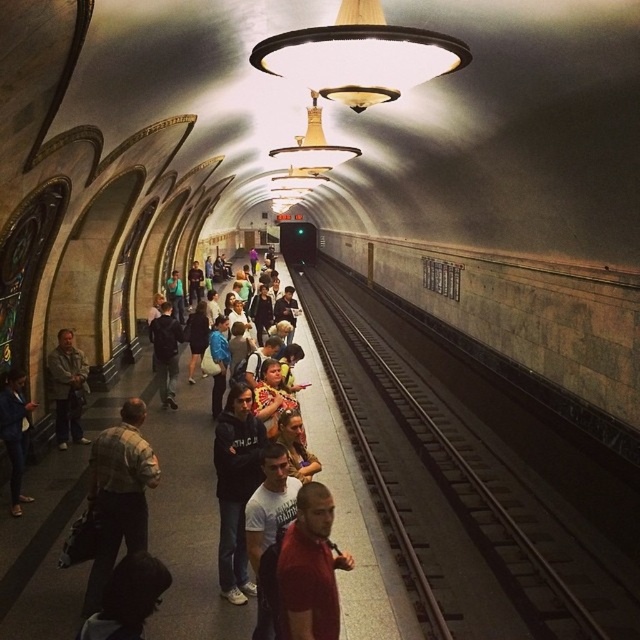
Which of these two, matte red shirt at center or black matte jacket at center, stands taller?

black matte jacket at center

Does matte red shirt at center come in front of black matte jacket at center?

Yes, matte red shirt at center is in front of black matte jacket at center.

Measure the distance between point (284, 556) and camera.

The distance of point (284, 556) from camera is 12.55 feet.

Identify the location of matte red shirt at center. (308, 570).

Does black metal train track at center appear on the right side of black matte jacket at center?

Indeed, black metal train track at center is positioned on the right side of black matte jacket at center.

Between black metal train track at center and black matte jacket at center, which one appears on the left side from the viewer's perspective?

From the viewer's perspective, black matte jacket at center appears more on the left side.

Which is behind, point (525, 580) or point (212, 460)?

Point (525, 580)

The image size is (640, 640). Identify the location of black metal train track at center. (465, 486).

Between point (148, 477) and point (320, 616), which one is positioned in front?

Point (320, 616) is more forward.

Which is more to the right, plaid shirt at center or matte red shirt at center?

From the viewer's perspective, matte red shirt at center appears more on the right side.

Between point (125, 502) and point (291, 611), which one is positioned behind?

The point (125, 502) is behind.

Find the location of `plaid shirt at center`. plaid shirt at center is located at coordinates (118, 496).